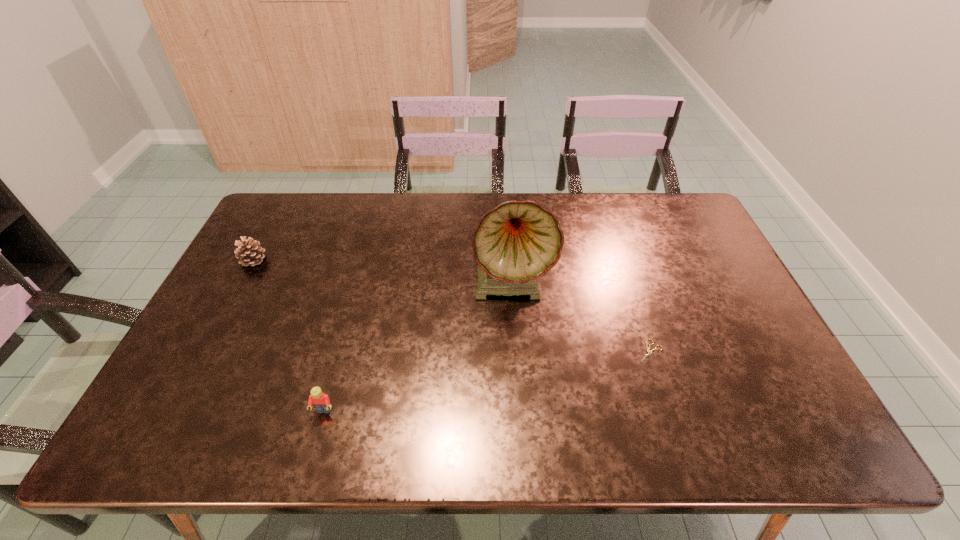
The height and width of the screenshot is (540, 960). What are the coordinates of `blank space located on the left of the shortest object` in the screenshot? It's located at [602, 352].

Locate an element on the screen. This screenshot has height=540, width=960. object that is at the near edge is located at coordinates (321, 402).

At what (x,y) coordinates should I click in order to perform the action: click on object at the left edge. Please return your answer as a coordinate pair (x, y). The width and height of the screenshot is (960, 540). Looking at the image, I should click on (249, 252).

You are a GUI agent. You are given a task and a screenshot of the screen. Output one action in this format:
    pyautogui.click(x=<x>, y=<y>)
    Task: Click on the vacant space at the far edge
    The width and height of the screenshot is (960, 540).
    Given the screenshot: What is the action you would take?
    pyautogui.click(x=325, y=204)

Find the location of a particular element. The height and width of the screenshot is (540, 960). vacant region at the near edge of the desktop is located at coordinates (572, 423).

In the image, there is a desktop. Identify the location of vacant space at the left edge. This screenshot has height=540, width=960. (191, 350).

This screenshot has width=960, height=540. What are the coordinates of `vacant space at the right edge` in the screenshot? It's located at (763, 370).

Where is `free location at the far left corner of the desktop`? free location at the far left corner of the desktop is located at coordinates (271, 202).

Locate an element on the screen. The height and width of the screenshot is (540, 960). free space at the far right corner is located at coordinates (682, 201).

Where is `free spot between the leftmost object and the rightmost object`? The height and width of the screenshot is (540, 960). free spot between the leftmost object and the rightmost object is located at coordinates (452, 306).